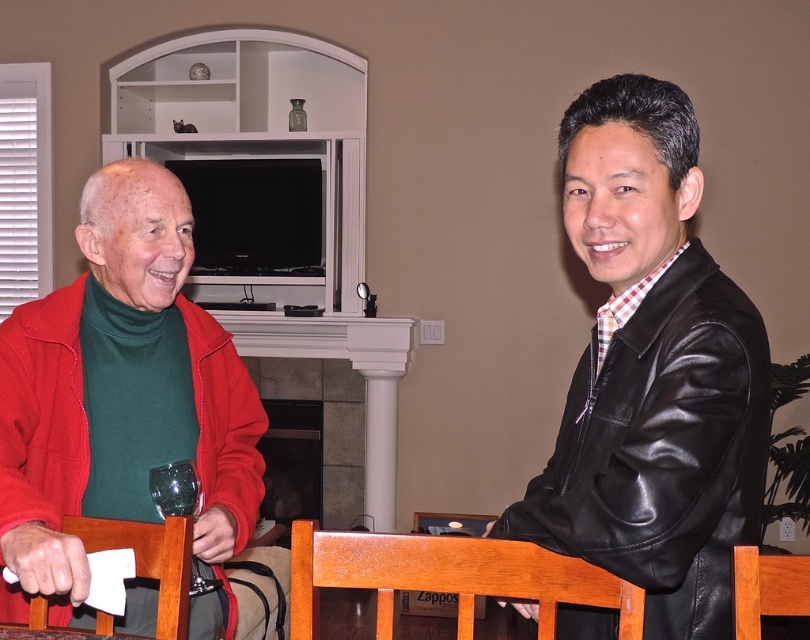
You are a delivery robot that is 20 inches wide. You need to move from the black leather jacket at right to the shiny green glass at lower left. Can you pass through the space between them?

The distance between the black leather jacket at right and the shiny green glass at lower left is 29.32 inches. Since the robot is 20 inches wide, it can pass through the space between them as the distance is wider than the robot.

You are standing in the living room and want to place a small plant on the fireplace mantel. The mantel is 1.2 meters wide. The matte red jacket at left is currently occupying some space. Can you estimate if there is enough space left on the mantel for the plant?

The matte red jacket at left is located at point (122, 394) on the mantel. Since the mantel is 1.2 meters wide, there should be sufficient space remaining for the plant after accounting for the jacket.

You are a photographer trying to capture a group photo of the people in the living room. You want to ensure that both the matte red jacket at left and the black leather jacket at right are clearly visible in the frame. Given their sizes, which jacket might you need to position closer to the camera to avoid being overshadowed?

The black leather jacket at right is shorter than the matte red jacket at left. To ensure visibility, position the black leather jacket at right closer to the camera so it appears larger in the frame.